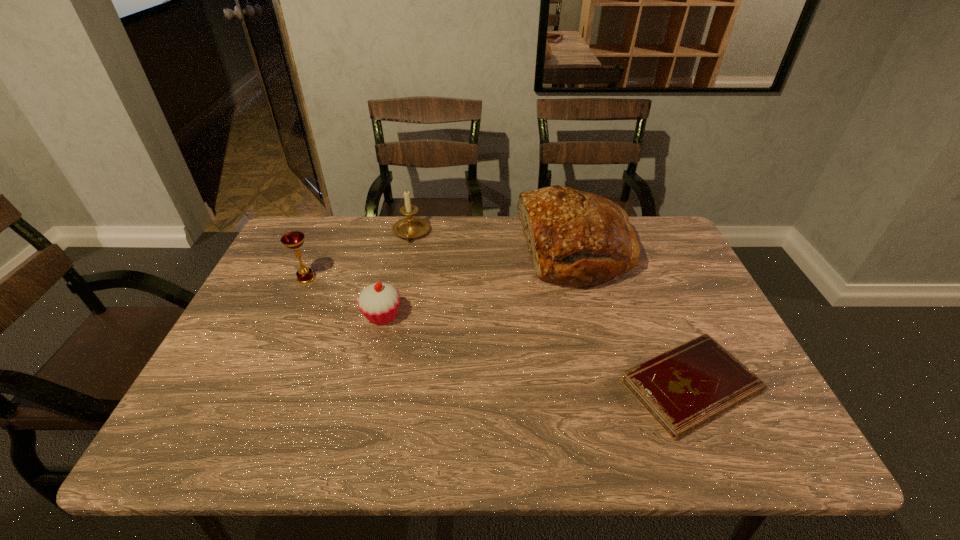
Find the location of `free space between the notebook and the candle holder`. free space between the notebook and the candle holder is located at coordinates (551, 309).

I want to click on vacant region between the second nearest object and the bread, so click(x=479, y=283).

The width and height of the screenshot is (960, 540). I want to click on free area in between the chalice and the candle holder, so click(359, 255).

Find the location of a particular element. free space between the nearest object and the cupcake is located at coordinates (537, 351).

Locate an element on the screen. The height and width of the screenshot is (540, 960). vacant space that's between the leftmost object and the tallest object is located at coordinates (441, 264).

At what (x,y) coordinates should I click in order to perform the action: click on free space between the notebook and the second nearest object. Please return your answer as a coordinate pair (x, y). This screenshot has height=540, width=960. Looking at the image, I should click on (537, 351).

Locate an element on the screen. This screenshot has height=540, width=960. unoccupied area between the fourth tallest object and the shortest object is located at coordinates (537, 351).

Identify which object is located as the second nearest to the leftmost object. Please provide its 2D coordinates. Your answer should be formatted as a tuple, i.e. [(x, y)], where the tuple contains the x and y coordinates of a point satisfying the conditions above.

[(411, 227)]

Select which object appears as the fourth closest to the bread. Please provide its 2D coordinates. Your answer should be formatted as a tuple, i.e. [(x, y)], where the tuple contains the x and y coordinates of a point satisfying the conditions above.

[(294, 240)]

Find the location of `vacant region that satisfies the following two spatial constraints: 1. at the sliced front of the nearest object; 2. on the left side of the tallest object`. vacant region that satisfies the following two spatial constraints: 1. at the sliced front of the nearest object; 2. on the left side of the tallest object is located at coordinates (612, 386).